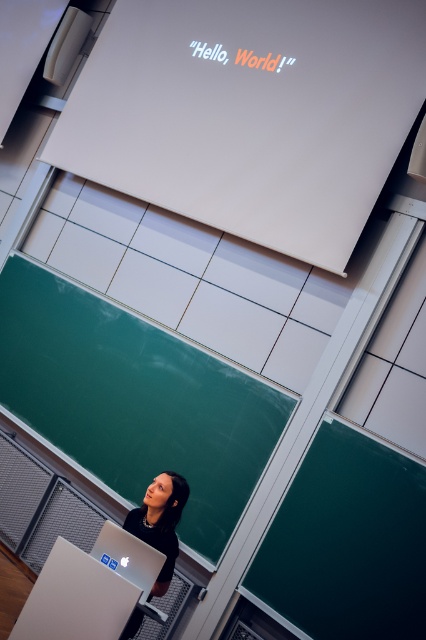
Question: Among these objects, which one is farthest from the camera?

Choices:
 (A) silver metallic laptop at lower center
 (B) matte black laptop at lower center
 (C) white glossy projector screen at upper center
 (D) green chalkboard at lower left

Answer: (C)

Question: Does white glossy projector screen at upper center appear under silver metallic laptop at lower center?

Choices:
 (A) no
 (B) yes

Answer: (A)

Question: Considering the relative positions of matte black laptop at lower center and silver metallic laptop at lower center in the image provided, where is matte black laptop at lower center located with respect to silver metallic laptop at lower center?

Choices:
 (A) left
 (B) right

Answer: (B)

Question: Which object appears farthest from the camera in this image?

Choices:
 (A) white glossy projector screen at upper center
 (B) matte black laptop at lower center
 (C) silver metallic laptop at lower center

Answer: (A)

Question: Considering the real-world distances, which object is closest to the white glossy projector screen at upper center?

Choices:
 (A) green matte/blackboard at lower right
 (B) silver metallic laptop at lower center
 (C) matte black laptop at lower center

Answer: (A)

Question: From the image, what is the correct spatial relationship of green chalkboard at lower left in relation to matte black laptop at lower center?

Choices:
 (A) above
 (B) below

Answer: (A)